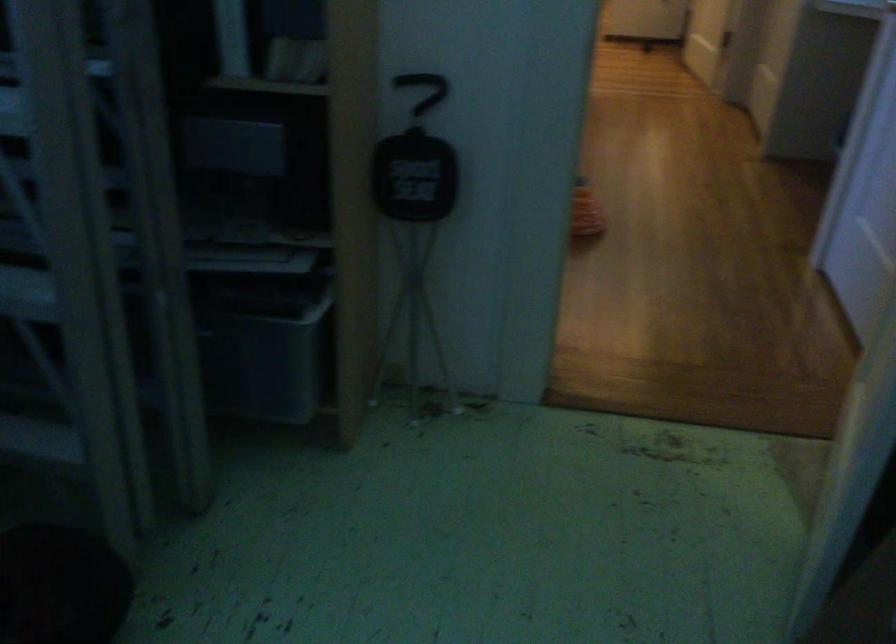
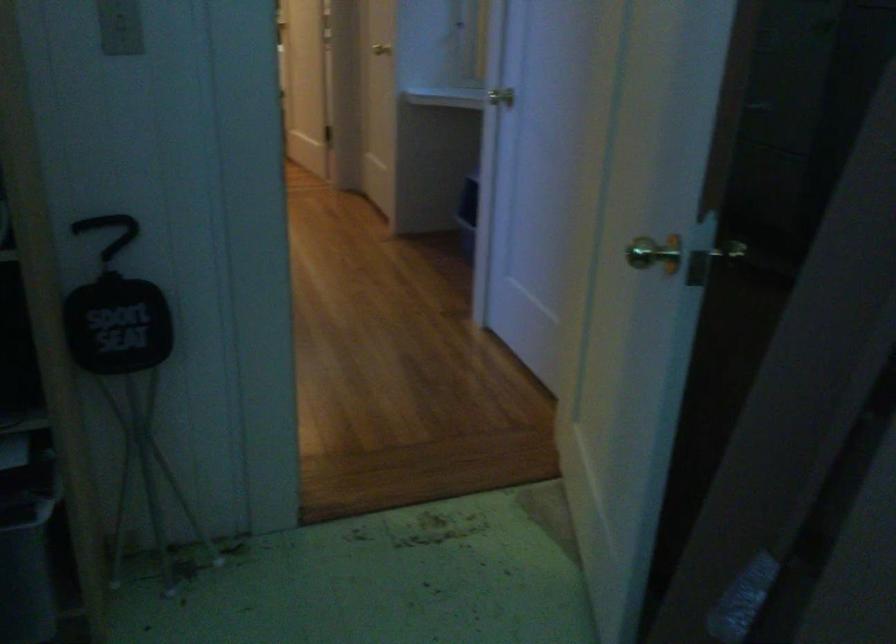
Question: Based on the continuous images, in which direction is the camera rotating? Reply with the corresponding letter.

Choices:
 (A) Left
 (B) Right
 (C) Up
 (D) Down

Answer: (B)